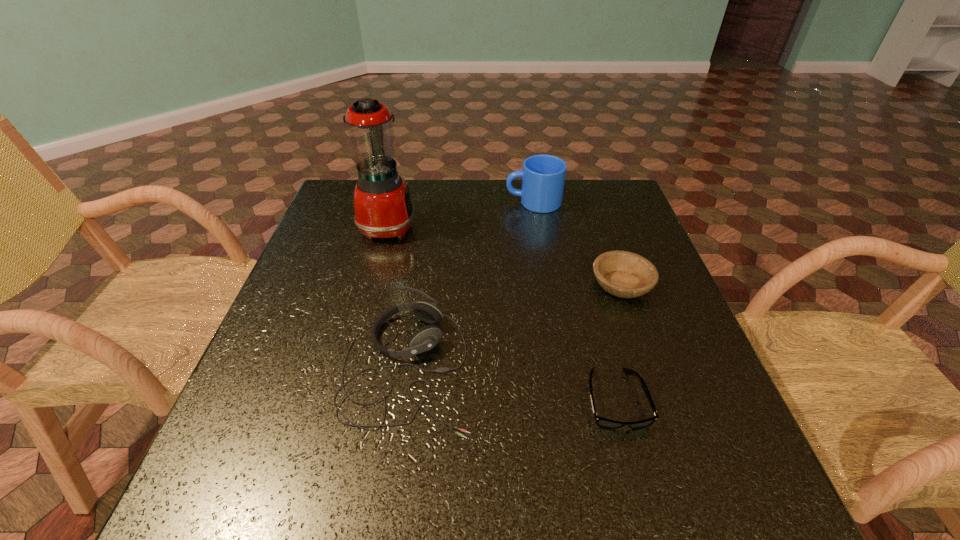
This screenshot has width=960, height=540. Identify the location of empty location between the third farthest object and the tallest object. (505, 255).

This screenshot has width=960, height=540. What are the coordinates of `free spot between the third farthest object and the third shortest object` in the screenshot? It's located at (515, 326).

At what (x,y) coordinates should I click in order to perform the action: click on free space between the sunglasses and the mug. Please return your answer as a coordinate pair (x, y). This screenshot has width=960, height=540. Looking at the image, I should click on (574, 301).

This screenshot has height=540, width=960. In order to click on free spot between the third farthest object and the food processor in this screenshot , I will do `click(505, 255)`.

The width and height of the screenshot is (960, 540). I want to click on vacant point located between the third tallest object and the mug, so click(x=470, y=284).

I want to click on the second closest object to the headset, so click(383, 208).

Image resolution: width=960 pixels, height=540 pixels. What are the coordinates of `the second closest object to the third shortest object` in the screenshot? It's located at (383, 208).

Image resolution: width=960 pixels, height=540 pixels. Identify the location of vacant space that satisfies the following two spatial constraints: 1. on the back side of the bowl; 2. on the side of the fourth shortest object with the handle. (592, 202).

This screenshot has width=960, height=540. I want to click on vacant point that satisfies the following two spatial constraints: 1. on the side of the bowl with the handle; 2. on the right side of the second tallest object, so click(x=547, y=285).

At what (x,y) coordinates should I click in order to perform the action: click on free point that satisfies the following two spatial constraints: 1. on the side of the mug with the handle; 2. on the left side of the second shortest object. Please return your answer as a coordinate pair (x, y). This screenshot has height=540, width=960. Looking at the image, I should click on (547, 285).